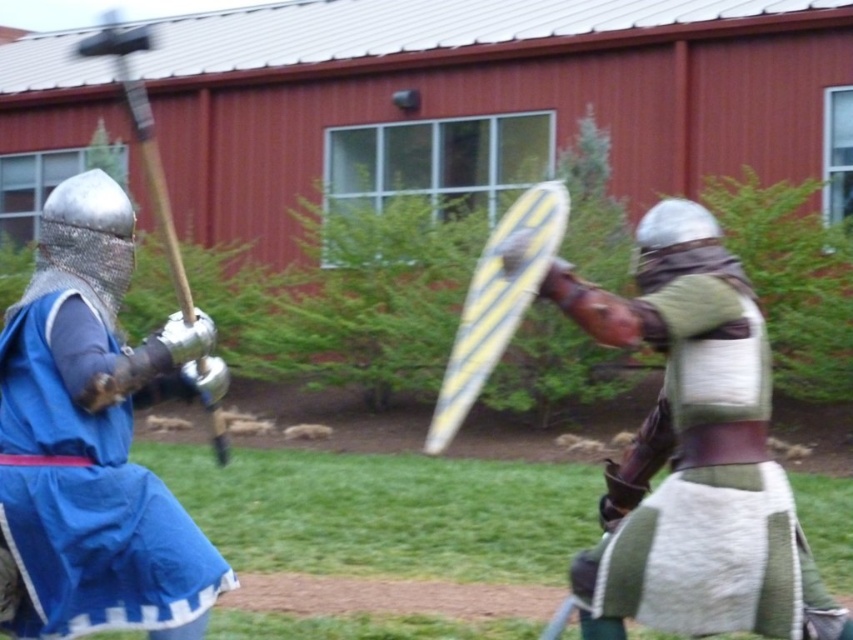
Between green woolen tunic at center and wooden polished mace at left, which one has less height?

green woolen tunic at center is shorter.

Who is positioned more to the right, green woolen tunic at center or wooden polished mace at left?

From the viewer's perspective, green woolen tunic at center appears more on the right side.

Describe the element at coordinates (694, 452) in the screenshot. This screenshot has height=640, width=853. I see `green woolen tunic at center` at that location.

What are the coordinates of `green woolen tunic at center` in the screenshot? It's located at (694, 452).

Does shiny blue tunic at left have a greater width compared to wooden polished mace at left?

In fact, shiny blue tunic at left might be narrower than wooden polished mace at left.

Which of these two, shiny blue tunic at left or wooden polished mace at left, stands taller?

wooden polished mace at left is taller.

Does point (22, 612) lie in front of point (163, 211)?

That is False.

Where is `shiny blue tunic at left`? The width and height of the screenshot is (853, 640). shiny blue tunic at left is located at coordinates (93, 438).

Consider the image. Is green woolen tunic at center wider than shiny blue tunic at left?

Indeed, green woolen tunic at center has a greater width compared to shiny blue tunic at left.

Is green woolen tunic at center shorter than shiny blue tunic at left?

Yes.

Is point (602, 592) closer to viewer compared to point (61, 444)?

No.

Find the location of a particular element. The image size is (853, 640). green woolen tunic at center is located at coordinates (694, 452).